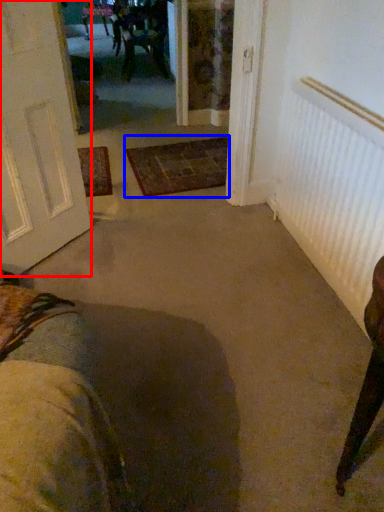
Question: Which point is closer to the camera, door (highlighted by a red box) or doormat (highlighted by a blue box)?

Choices:
 (A) door
 (B) doormat

Answer: (A)